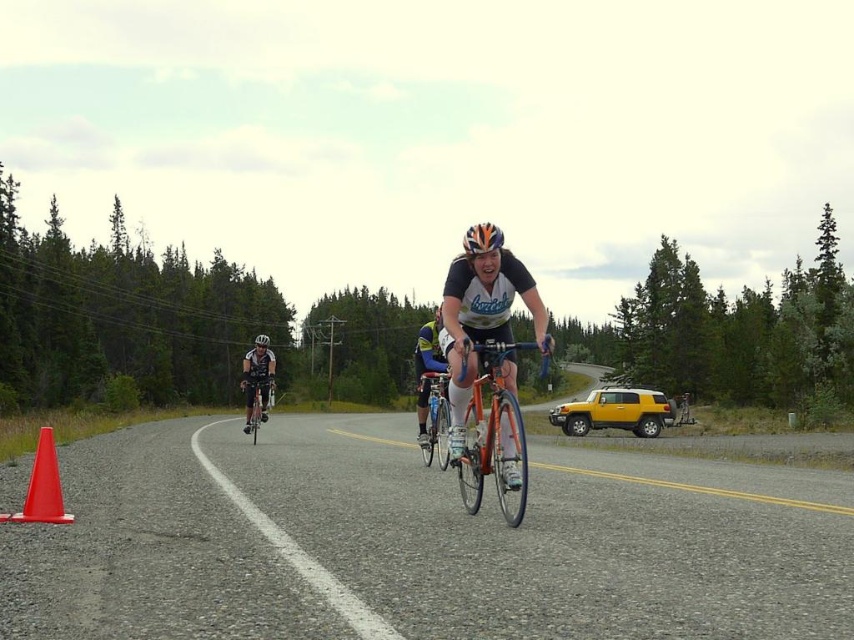
You are a cyclist participating in a race and see the yellow matte suv at right and the white matte bicycle helmet at center. Which object is closer to you as you look ahead on the road?

The white matte bicycle helmet at center is closer to you because it is positioned in front of the yellow matte suv at right, which is further away.